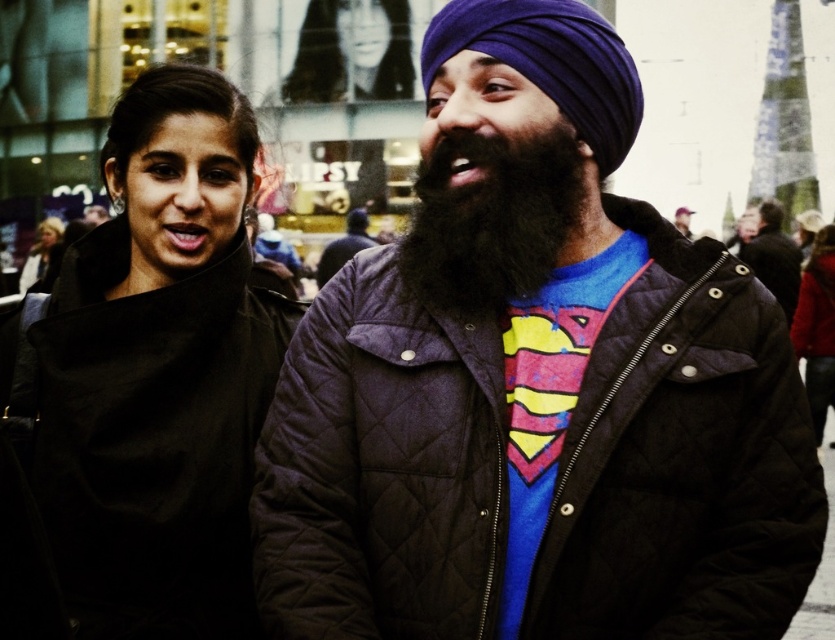
Question: Can you confirm if black matte coat at center is positioned below black quilted jacket at center?

Choices:
 (A) no
 (B) yes

Answer: (B)

Question: Which object is closer to the camera taking this photo?

Choices:
 (A) dark brown thick beard at center
 (B) black quilted jacket at center
 (C) purple fabric turban at upper center
 (D) quilted black jacket at right

Answer: (D)

Question: Observing the image, what is the correct spatial positioning of black matte coat at center in reference to purple fabric turban at upper center?

Choices:
 (A) right
 (B) left

Answer: (B)

Question: Considering the relative positions of black matte coat at center and black quilted jacket at center in the image provided, where is black matte coat at center located with respect to black quilted jacket at center?

Choices:
 (A) right
 (B) left

Answer: (B)

Question: Which object appears farthest from the camera in this image?

Choices:
 (A) purple fabric turban at upper center
 (B) smooth black hair at upper center
 (C) black quilted jacket at center
 (D) dark brown thick beard at center

Answer: (C)

Question: Which of the following is the closest to the observer?

Choices:
 (A) purple quilted jacket at center
 (B) smooth black hair at upper center

Answer: (A)